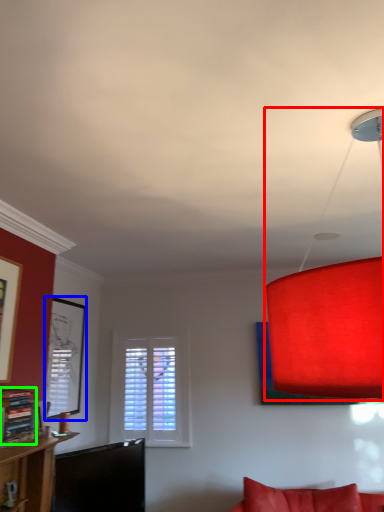
Question: Based on their relative distances, which object is farther from lamp (highlighted by a red box)? Choose from picture frame (highlighted by a blue box) and shelf (highlighted by a green box).

Choices:
 (A) picture frame
 (B) shelf

Answer: (A)